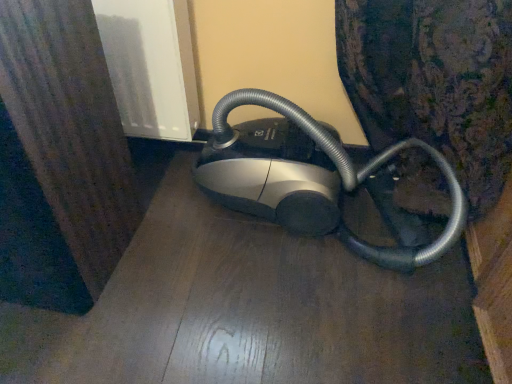
Identify the location of blank area beneath silver metallic vacuum cleaner at center (from a real-world perspective). The width and height of the screenshot is (512, 384). (307, 236).